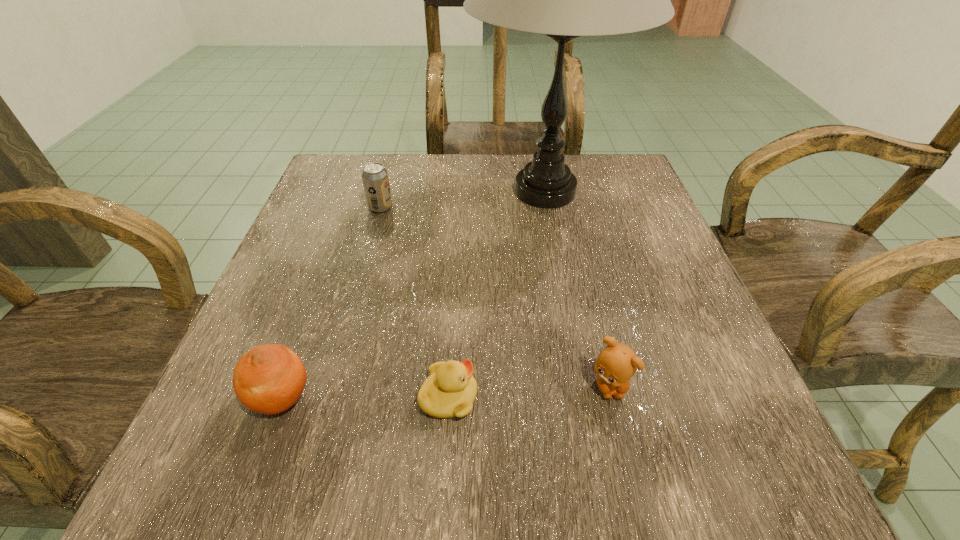
Identify the location of free area in between the beer can and the duckling. pos(415,302).

Identify which object is located as the fourth nearest to the tallest object. Please provide its 2D coordinates. Your answer should be formatted as a tuple, i.e. [(x, y)], where the tuple contains the x and y coordinates of a point satisfying the conditions above.

[(268, 379)]

What are the coordinates of `object that is the closest one to the tallest object` in the screenshot? It's located at (375, 179).

At what (x,y) coordinates should I click in order to perform the action: click on vacant space that satisfies the following two spatial constraints: 1. on the face of the teddy bear; 2. on the front-facing side of the shortest object. Please return your answer as a coordinate pair (x, y). The height and width of the screenshot is (540, 960). Looking at the image, I should click on (612, 397).

Where is `vacant space that satisfies the following two spatial constraints: 1. on the front side of the lamp; 2. on the front-facing side of the duckling`? This screenshot has height=540, width=960. vacant space that satisfies the following two spatial constraints: 1. on the front side of the lamp; 2. on the front-facing side of the duckling is located at coordinates (584, 397).

You are a GUI agent. You are given a task and a screenshot of the screen. Output one action in this format:
    pyautogui.click(x=<x>, y=<y>)
    Task: Click on the vacant space that satisfies the following two spatial constraints: 1. on the front-facing side of the shortest object; 2. on the front side of the orange
    The image size is (960, 540).
    Given the screenshot: What is the action you would take?
    pyautogui.click(x=448, y=398)

I want to click on blank area in the image that satisfies the following two spatial constraints: 1. on the face of the teddy bear; 2. on the front-facing side of the shortest object, so click(612, 397).